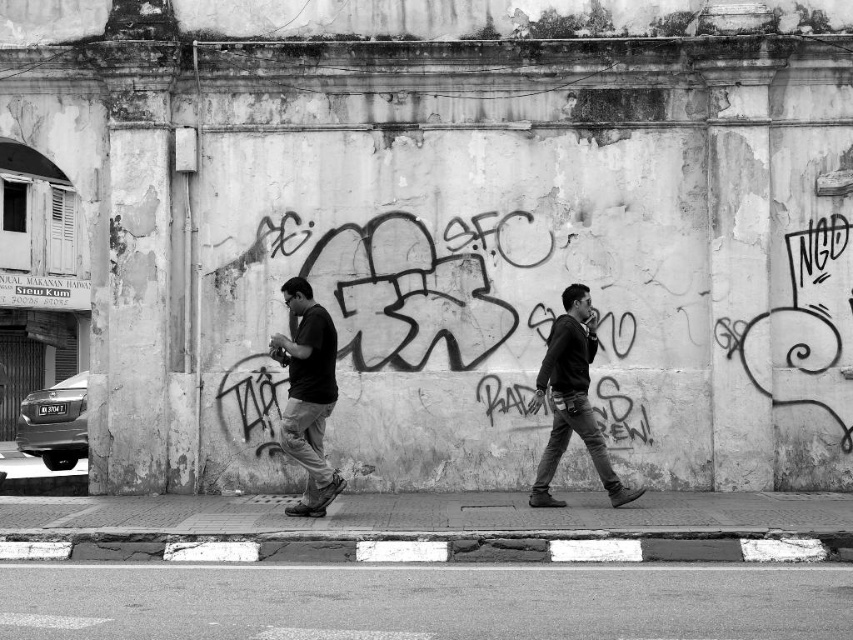
Which is more to the right, matte black shirt at center or dark gray hoodie at center?

Positioned to the right is dark gray hoodie at center.

Does matte black shirt at center have a larger size compared to dark gray hoodie at center?

No.

You are a GUI agent. You are given a task and a screenshot of the screen. Output one action in this format:
    pyautogui.click(x=<x>, y=<y>)
    Task: Click on the matte black shirt at center
    
    Given the screenshot: What is the action you would take?
    pyautogui.click(x=308, y=394)